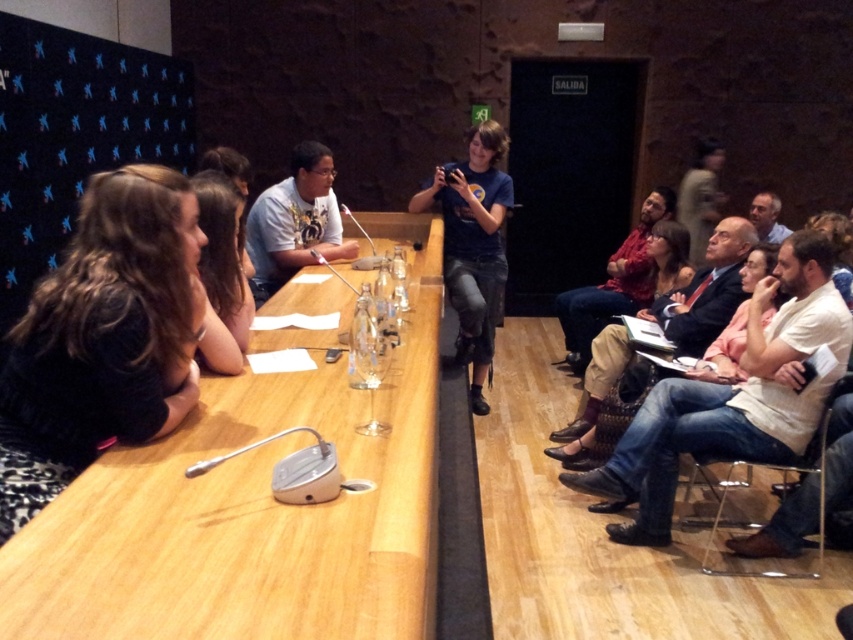
Is wooden table at center bigger than white cotton shirt at right?

Indeed, wooden table at center has a larger size compared to white cotton shirt at right.

Can you confirm if wooden table at center is positioned to the left of white cotton shirt at right?

Indeed, wooden table at center is positioned on the left side of white cotton shirt at right.

Identify the location of wooden table at center. (251, 512).

Where is `wooden table at center`? Image resolution: width=853 pixels, height=640 pixels. wooden table at center is located at coordinates (251, 512).

Does white cotton shirt at right have a smaller size compared to blue t-shirt at center?

Yes, white cotton shirt at right is smaller than blue t-shirt at center.

Identify the location of white cotton shirt at right. (730, 397).

Where is `white cotton shirt at right`? This screenshot has width=853, height=640. white cotton shirt at right is located at coordinates (730, 397).

Does wooden table at center have a greater height compared to red shirt at right?

No.

Is wooden table at center further to the viewer compared to red shirt at right?

That is False.

Which is in front, point (74, 566) or point (567, 301)?

Point (74, 566)

The width and height of the screenshot is (853, 640). I want to click on wooden table at center, so click(x=251, y=512).